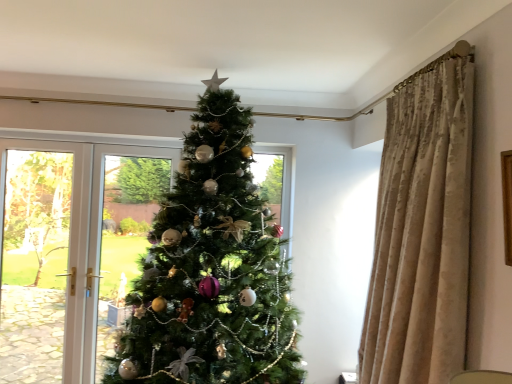
This screenshot has width=512, height=384. What do you see at coordinates (212, 269) in the screenshot?
I see `green matte christmas tree at center` at bounding box center [212, 269].

You are a GUI agent. You are given a task and a screenshot of the screen. Output one action in this format:
    pyautogui.click(x=<x>, y=<y>)
    Task: Click on the green matte christmas tree at center
    
    Given the screenshot: What is the action you would take?
    pyautogui.click(x=212, y=269)

In order to face green matte christmas tree at center, should I rotate leftwards or rightwards?

Rotate left and turn 8.120 degrees.

In order to click on green matte christmas tree at center in this screenshot , I will do `click(212, 269)`.